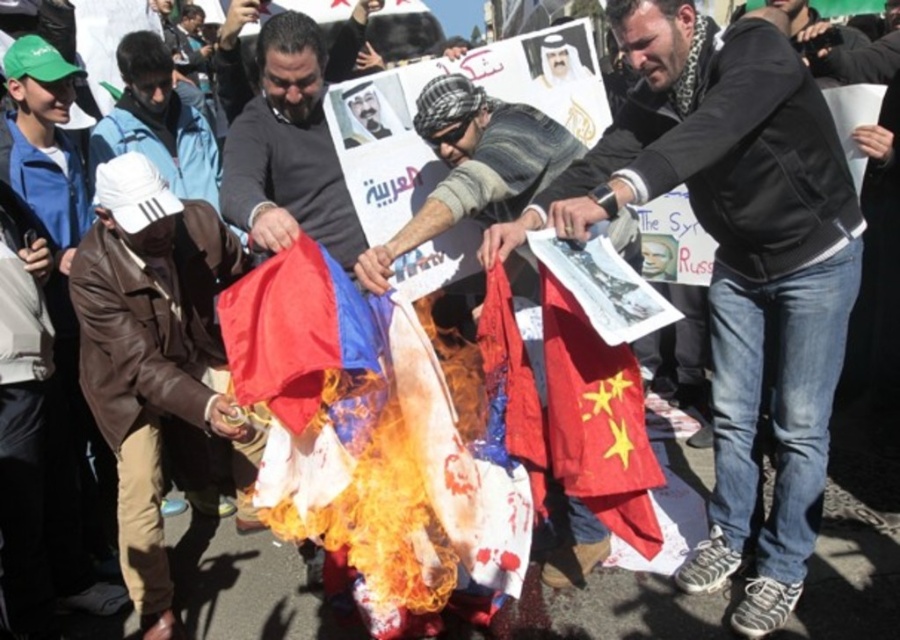
Based on the scene description, which face at the center is shorter between the smooth skin face at center and the smooth beige face at center?

The smooth skin face at center is shorter than the smooth beige face at center.

You are a journalist covering the protest and need to describe the flags in your report. Which flag is closer to the camera, the red fabric flag at center or the shiny nylon flag at center?

The red fabric flag at center is closer to the camera because the shiny nylon flag at center is behind it.